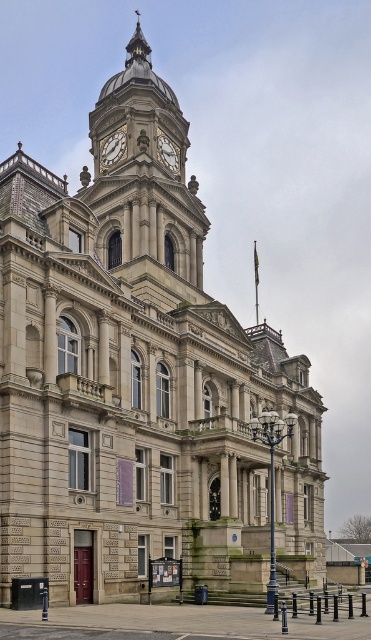
Question: Can you confirm if golden stone clock tower at upper center is positioned above white marble clock at upper center?

Choices:
 (A) yes
 (B) no

Answer: (A)

Question: Which point is closer to the camera?

Choices:
 (A) white marble clock at upper center
 (B) golden stone clock tower at upper center
 (C) matte gray clock at upper center

Answer: (B)

Question: Does matte gray clock at upper center appear on the left side of white marble clock at upper center?

Choices:
 (A) yes
 (B) no

Answer: (A)

Question: Among these points, which one is farthest from the camera?

Choices:
 (A) [x=139, y=168]
 (B) [x=162, y=132]

Answer: (B)

Question: Where is golden stone clock tower at upper center located in relation to white marble clock at upper center in the image?

Choices:
 (A) below
 (B) above

Answer: (B)

Question: Which is farther from the golden stone clock tower at upper center?

Choices:
 (A) white marble clock at upper center
 (B) matte gray clock at upper center

Answer: (A)